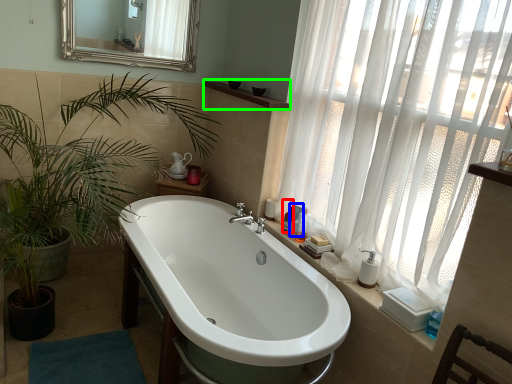
Question: Considering the real-world distances, which object is farthest from toiletry (highlighted by a red box)? toiletry (highlighted by a blue box) or balustrade (highlighted by a green box)?

Choices:
 (A) toiletry
 (B) balustrade

Answer: (B)